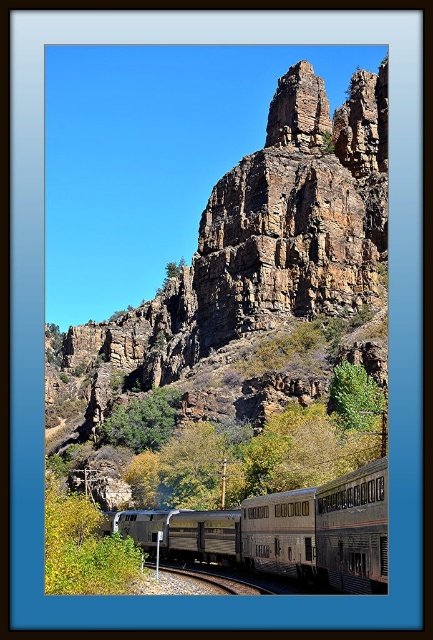
Question: Is silver metallic train at center further to the viewer compared to metal/smooth track at lower center?

Choices:
 (A) yes
 (B) no

Answer: (B)

Question: Considering the real-world distances, which object is closest to the metal/smooth track at lower center?

Choices:
 (A) rugged brown rock formation at center
 (B) silver metallic train at center

Answer: (B)

Question: Which of these objects is positioned farthest from the silver metallic train at center?

Choices:
 (A) rugged brown rock formation at center
 (B) metal/smooth track at lower center

Answer: (A)

Question: Is rugged brown rock formation at center to the right of metal/smooth track at lower center from the viewer's perspective?

Choices:
 (A) yes
 (B) no

Answer: (B)

Question: Is rugged brown rock formation at center smaller than metal/smooth track at lower center?

Choices:
 (A) yes
 (B) no

Answer: (B)

Question: Which of the following is the farthest from the observer?

Choices:
 (A) (113, 374)
 (B) (361, 477)
 (C) (210, 579)

Answer: (A)